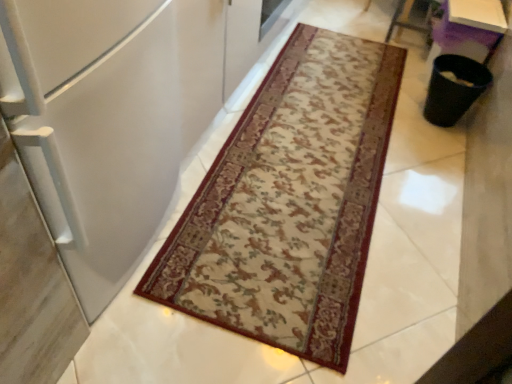
Where is `vacant area that is situated to the right of white matte refrigerator at left`? This screenshot has width=512, height=384. vacant area that is situated to the right of white matte refrigerator at left is located at coordinates (275, 177).